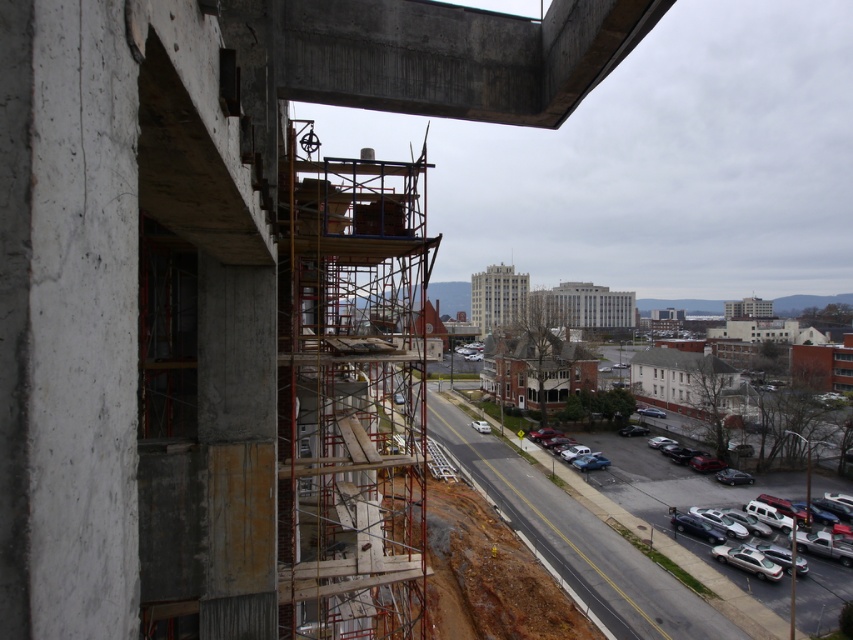
Question: Is concrete overpass at upper center thinner than silver metallic sedan at lower right?

Choices:
 (A) yes
 (B) no

Answer: (A)

Question: Which point is closer to the camera?

Choices:
 (A) (734, 522)
 (B) (267, 88)

Answer: (B)

Question: In this image, where is concrete overpass at upper center located relative to silver metallic sedan at lower right?

Choices:
 (A) above
 (B) below

Answer: (A)

Question: Which point is closer to the camera?

Choices:
 (A) (729, 524)
 (B) (405, 68)

Answer: (B)

Question: Considering the relative positions of concrete overpass at upper center and silver metallic sedan at lower right in the image provided, where is concrete overpass at upper center located with respect to silver metallic sedan at lower right?

Choices:
 (A) above
 (B) below

Answer: (A)

Question: Which of the following is the closest to the observer?

Choices:
 (A) concrete overpass at upper center
 (B) silver metallic sedan at lower right

Answer: (A)